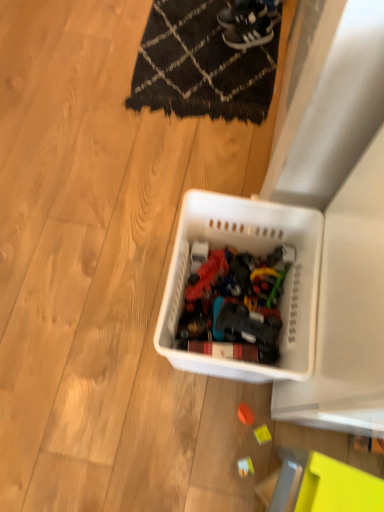
Identify the location of vacant space in front of black suede sneakers at upper center, acting as the 1th footwear starting from the top. This screenshot has width=384, height=512. (233, 53).